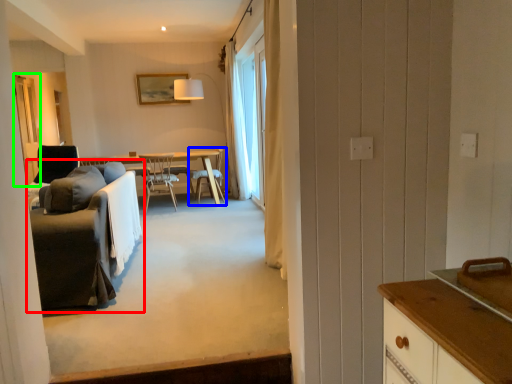
Question: Which object is positioned farthest from studio couch (highlighted by a red box)? Select from chair (highlighted by a blue box) and screen door (highlighted by a green box).

Choices:
 (A) chair
 (B) screen door

Answer: (A)